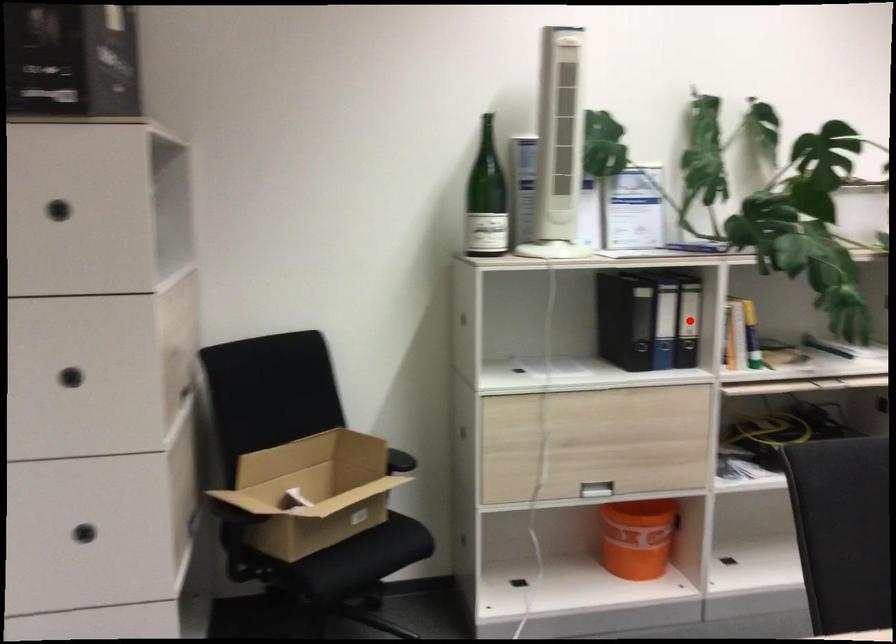
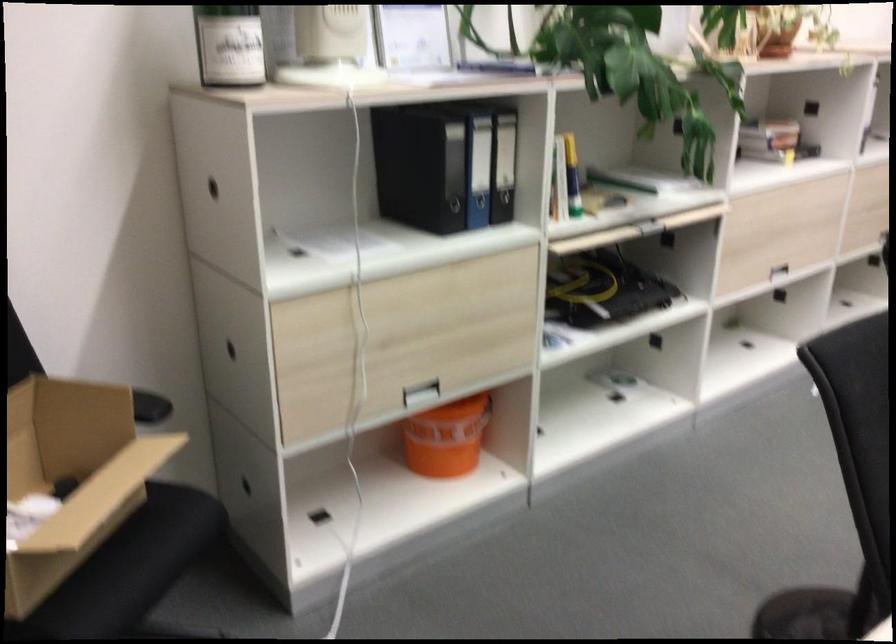
In the second image, find the point that corresponds to the highlighted location in the first image.

(504, 165)